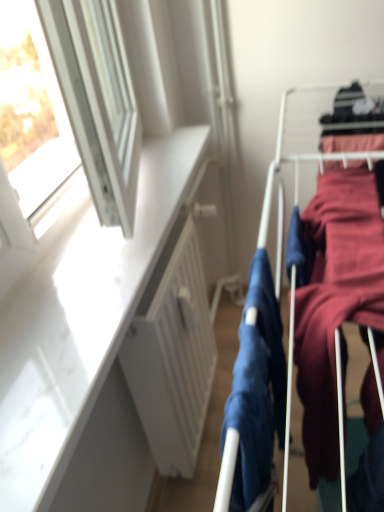
Question: From a real-world perspective, is matte blue fabric at center, arranged as the 2th clothing when viewed from the right, above or below white matte radiator at center?

Choices:
 (A) below
 (B) above

Answer: (B)

Question: From their relative heights in the image, would you say matte blue fabric at center, which is counted as the 1th clothing, starting from the left, is taller or shorter than white matte radiator at center?

Choices:
 (A) tall
 (B) short

Answer: (B)

Question: Considering the real-world distances, which object is farthest from the velvet-like maroon dress at right, the 1th clothing positioned from the right?

Choices:
 (A) white matte radiator at center
 (B) matte blue fabric at center, which is counted as the 1th clothing, starting from the left

Answer: (A)

Question: Based on their relative distances, which object is nearer to the white matte radiator at center?

Choices:
 (A) velvet-like maroon dress at right, the 1th clothing positioned from the right
 (B) matte blue fabric at center, which is counted as the 1th clothing, starting from the left

Answer: (B)